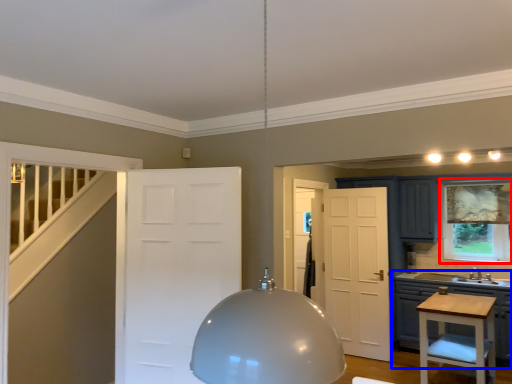
Question: Which of the following is the farthest to the observer, window (highlighted by a red box) or cabinetry (highlighted by a blue box)?

Choices:
 (A) window
 (B) cabinetry

Answer: (A)